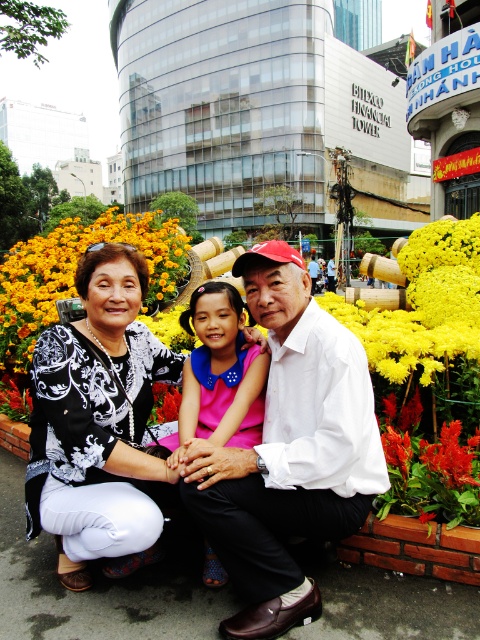
What do you see at coordinates (288, 451) in the screenshot? I see `white matte shirt at center` at bounding box center [288, 451].

How much distance is there between white matte shirt at center and pink satin dress at center?

18.04 inches

The height and width of the screenshot is (640, 480). What are the coordinates of `white matte shirt at center` in the screenshot? It's located at (288, 451).

Which of these two, yellow matte flowers at center or pink satin dress at center, stands taller?

yellow matte flowers at center

Which is above, yellow matte flowers at center or pink satin dress at center?

yellow matte flowers at center is higher up.

Identify the location of yellow matte flowers at center. The image size is (480, 640). (74, 269).

Where is `yellow matte flowers at center`? yellow matte flowers at center is located at coordinates (74, 269).

Which of these two, black printed blouse at center or yellow matte flowers at center, stands taller?

yellow matte flowers at center

Is point (105, 275) farther from viewer compared to point (34, 324)?

That is False.

This screenshot has height=640, width=480. I want to click on black printed blouse at center, so click(96, 419).